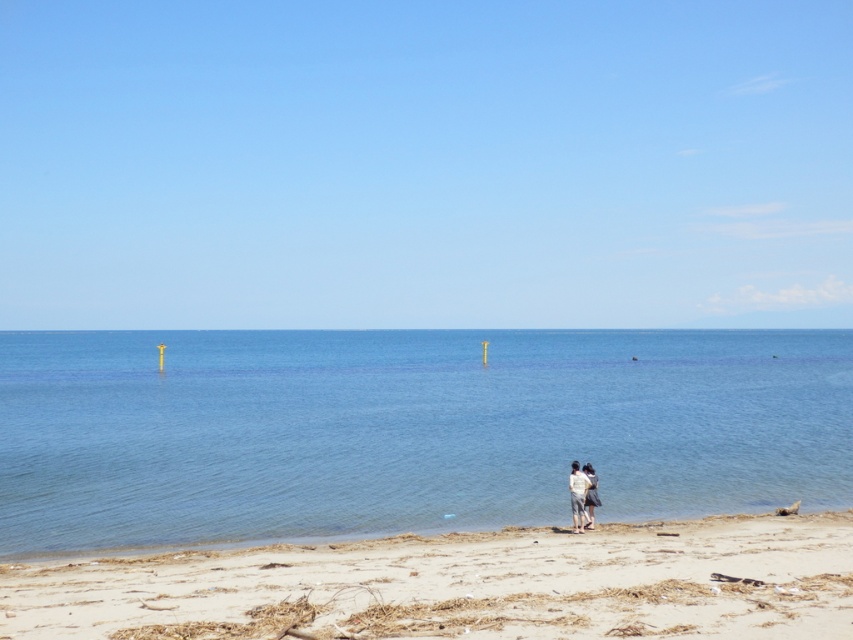
Does light beige sand at lower center have a greater width compared to white cotton shirt at center?

Yes, light beige sand at lower center is wider than white cotton shirt at center.

Is light beige sand at lower center to the right of white cotton shirt at center from the viewer's perspective?

Incorrect, light beige sand at lower center is not on the right side of white cotton shirt at center.

Find the location of a particular element. light beige sand at lower center is located at coordinates (461, 586).

You are a GUI agent. You are given a task and a screenshot of the screen. Output one action in this format:
    pyautogui.click(x=<x>, y=<y>)
    Task: Click on the light beige sand at lower center
    
    Given the screenshot: What is the action you would take?
    pyautogui.click(x=461, y=586)

Does light gray cotton shirt at lower center have a lesser height compared to white cotton shirt at center?

No.

Does light gray cotton shirt at lower center appear on the left side of white cotton shirt at center?

Indeed, light gray cotton shirt at lower center is positioned on the left side of white cotton shirt at center.

The width and height of the screenshot is (853, 640). Find the location of `light gray cotton shirt at lower center`. light gray cotton shirt at lower center is located at coordinates (577, 497).

Does blue water at center have a greater width compared to light gray cotton shirt at lower center?

Yes.

Can you confirm if blue water at center is thinner than light gray cotton shirt at lower center?

No.

Is point (39, 513) less distant than point (569, 476)?

That is False.

Identify the location of blue water at center. (405, 429).